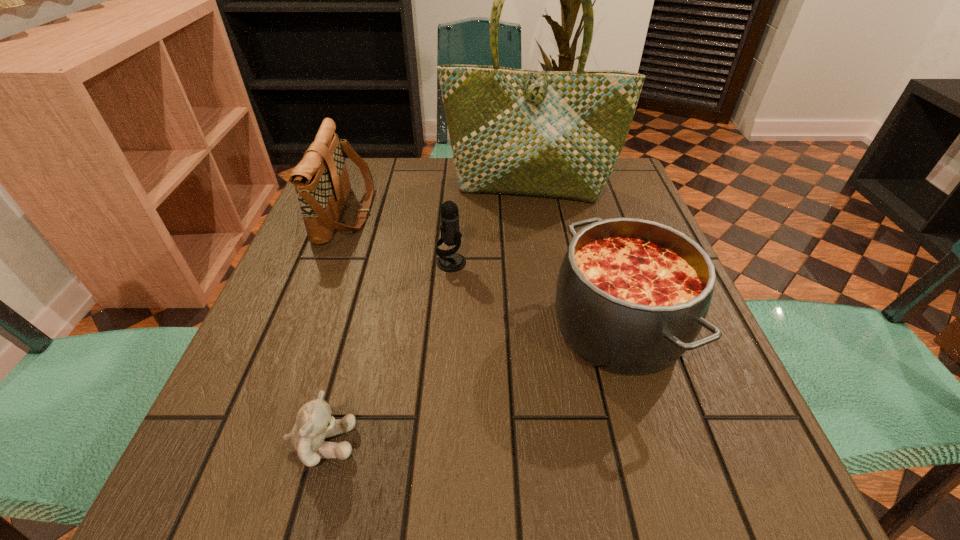
Locate an element on the screen. This screenshot has width=960, height=540. empty location between the shoulder bag and the tallest object is located at coordinates [x=438, y=200].

Find the location of `vacant space in between the shopping bag and the shoulder bag`. vacant space in between the shopping bag and the shoulder bag is located at coordinates (438, 200).

The width and height of the screenshot is (960, 540). What are the coordinates of `vacant region between the shopping bag and the teddy bear` in the screenshot? It's located at (425, 315).

This screenshot has height=540, width=960. Find the location of `free point between the shoulder bag and the shortest object`. free point between the shoulder bag and the shortest object is located at coordinates (334, 328).

The image size is (960, 540). I want to click on empty location between the microphone and the casserole, so [535, 295].

Image resolution: width=960 pixels, height=540 pixels. I want to click on free space between the casserole and the microphone, so point(535,295).

You are a GUI agent. You are given a task and a screenshot of the screen. Output one action in this format:
    pyautogui.click(x=<x>, y=<y>)
    Task: Click on the second closest object to the shoulder bag
    Image resolution: width=960 pixels, height=540 pixels.
    Given the screenshot: What is the action you would take?
    pyautogui.click(x=449, y=261)

Choose which object is the second nearest neighbor to the shortest object. Please provide its 2D coordinates. Your answer should be formatted as a tuple, i.e. [(x, y)], where the tuple contains the x and y coordinates of a point satisfying the conditions above.

[(449, 261)]

The width and height of the screenshot is (960, 540). Find the location of `free region that satisfies the following two spatial constraints: 1. on the front-facing side of the shoulder bag; 2. on the back side of the casserole`. free region that satisfies the following two spatial constraints: 1. on the front-facing side of the shoulder bag; 2. on the back side of the casserole is located at coordinates [x=302, y=328].

Image resolution: width=960 pixels, height=540 pixels. I want to click on free space that satisfies the following two spatial constraints: 1. on the front side of the tallest object; 2. on the right side of the casserole, so (549, 328).